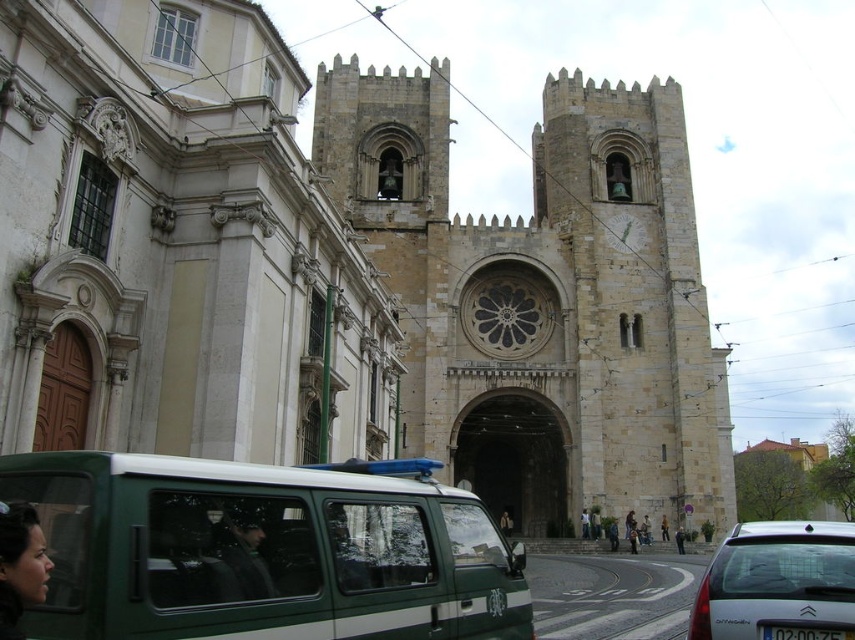
You are a delivery driver who needs to park your vehicle next to the cathedral. You have two options for parking spots available. One is next to the green matte van at center, and the other is next to the white glossy car at lower right. Which parking spot has more space for your vehicle?

The parking spot next to the white glossy car at lower right has more space because the green matte van at center is narrower than the white glossy car at lower right, meaning the spot next to the van might be tighter.

You are standing on the sidewalk in front of the beige stone church at center. You want to take a photo of the church with your smartphone, which has a maximum zoom range of 10 meters. Can you capture the entire church in your photo without moving closer?

The beige stone church at center is 43.95 meters away from the viewer. Since your smartphone can only zoom up to 10 meters, you cannot capture the entire church without moving closer.

Consider the image. You are standing at the camera position and want to take a photo of the beige stone church at center. If your camera has a maximum focus range of 40 meters, will you be able to capture the church clearly?

The beige stone church at center is 43.95 meters away from the camera. Since this distance exceeds the camera maximum focus range of 40 meters, you will not be able to capture the church clearly.